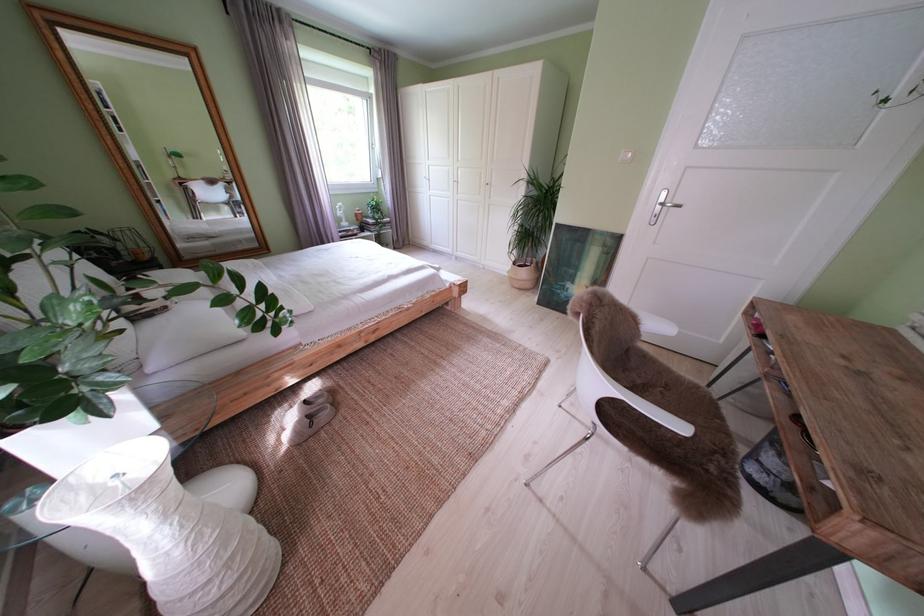
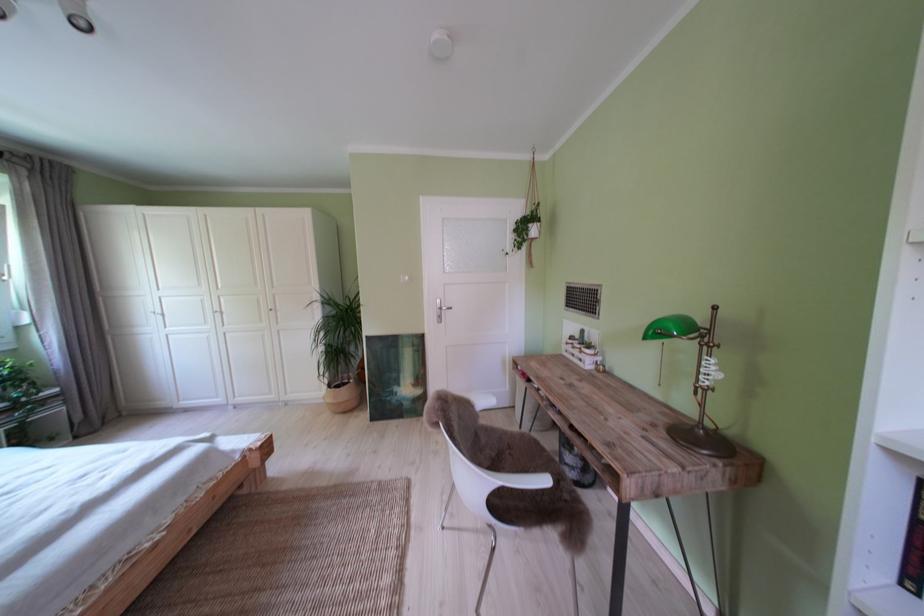
Where in the second image is the point corresponding to pixel 526 269 from the first image?

(341, 392)